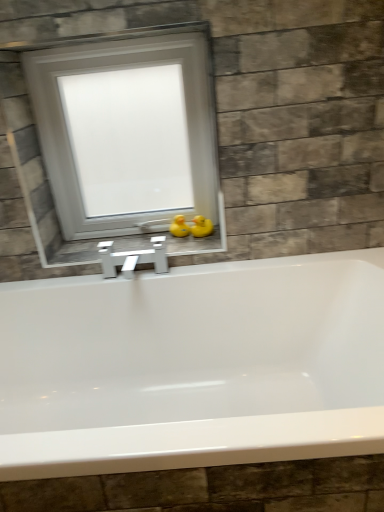
Question: Choose the correct answer: Is white frosted glass window at upper center inside yellow rubber duck at center, which is the first duck from left to right, or outside it?

Choices:
 (A) outside
 (B) inside

Answer: (A)

Question: In terms of height, does white frosted glass window at upper center look taller or shorter compared to yellow rubber duck at center, which is the first duck from left to right?

Choices:
 (A) short
 (B) tall

Answer: (B)

Question: Estimate the real-world distances between objects in this image. Which object is farther from the yellow rubber duck at center, the first duck when ordered from right to left?

Choices:
 (A) yellow rubber duck at center, the second duck viewed from the right
 (B) white glossy window sill at center
 (C) white frosted glass window at upper center

Answer: (C)

Question: Estimate the real-world distances between objects in this image. Which object is closer to the white glossy window sill at center?

Choices:
 (A) yellow rubber duck at center, the second duck viewed from the right
 (B) yellow rubber duck at center, the first duck when ordered from right to left
 (C) white frosted glass window at upper center

Answer: (A)